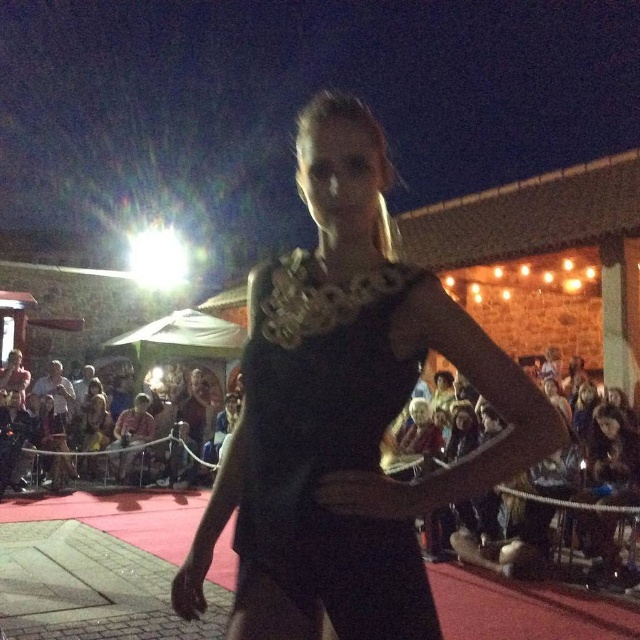
You are a photographer at the event and need to capture a closeup shot of both the black matte dress at center and the black satin dress at center. Which dress should you focus on first to ensure it fits entirely within your camera frame if your frame can only accommodate the wider of the two dresses?

The black matte dress at center is wider than the black satin dress at center, so you should focus on the black matte dress at center first to ensure it fits within the camera frame.

You are a photographer positioned at the front of the event. You want to capture a photo that includes both the black matte dress at center and the light brown fabric hat at lower center. Given that your camera has a maximum focus range of 8 meters, will you be able to capture both objects in focus?

The black matte dress at center and light brown fabric hat at lower center are 8.55 meters apart from each other. Since the distance between them exceeds the camera maximum focus range of 8 meters, you won

You are a photographer at the event and want to capture a clear photo of the black satin dress at center without the light brown fabric hat at lower center blocking it. Is this possible?

The black satin dress at center is in front of the light brown fabric hat at lower center, so it will block the view of the hat. Therefore, you cannot take a clear photo of the dress without the hat being in the frame.